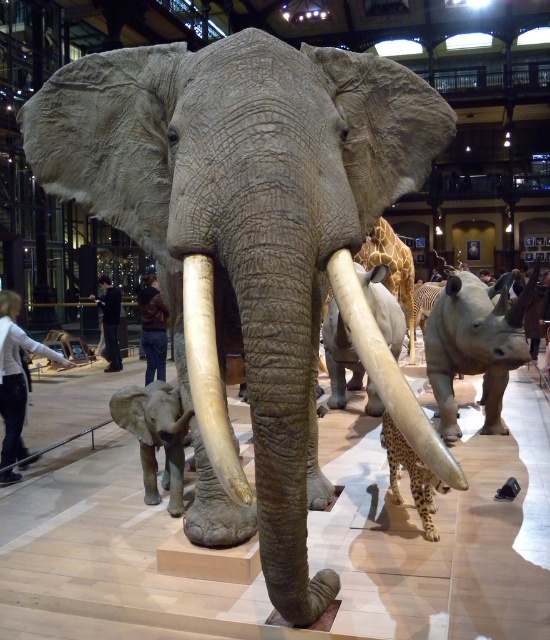
Based on the photo, between white ivory tusk at center and gray matte elephant at lower left, which one appears on the right side from the viewer's perspective?

white ivory tusk at center is more to the right.

Can you confirm if white ivory tusk at center is positioned to the left of gray matte elephant at lower left?

In fact, white ivory tusk at center is to the right of gray matte elephant at lower left.

Is point (198, 285) positioned before point (140, 445)?

Yes.

Where is `white ivory tusk at center`? Image resolution: width=550 pixels, height=640 pixels. white ivory tusk at center is located at coordinates (209, 378).

Who is positioned more to the right, matte gray rhinoceros at right or matte ivory tusk at center?

matte gray rhinoceros at right

Can you confirm if matte gray rhinoceros at right is bigger than matte ivory tusk at center?

Yes.

The height and width of the screenshot is (640, 550). Identify the location of matte gray rhinoceros at right. (475, 344).

Does white ivory tusk at center have a lesser width compared to matte gray rhinoceros at center?

Yes, white ivory tusk at center is thinner than matte gray rhinoceros at center.

Find the location of a particular element. white ivory tusk at center is located at coordinates (209, 378).